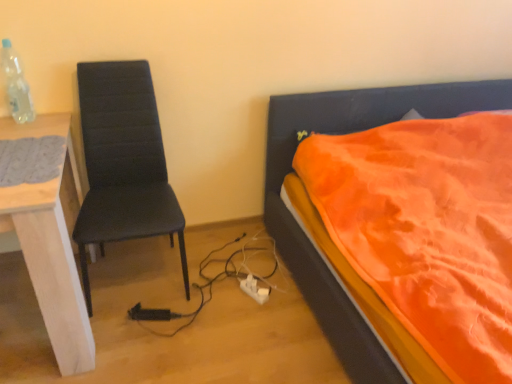
This screenshot has width=512, height=384. Describe the element at coordinates (303, 232) in the screenshot. I see `orange fabric bed at right` at that location.

What is the approximate height of white plastic power plugs and sockets at lower center?

white plastic power plugs and sockets at lower center is 1.58 inches in height.

The height and width of the screenshot is (384, 512). Find the location of `white plastic power plugs and sockets at lower center`. white plastic power plugs and sockets at lower center is located at coordinates (254, 289).

Where is `clear plastic bottle at upper left`? The height and width of the screenshot is (384, 512). clear plastic bottle at upper left is located at coordinates (16, 85).

The width and height of the screenshot is (512, 384). What do you see at coordinates (123, 163) in the screenshot? I see `matte black chair at left` at bounding box center [123, 163].

Measure the distance between point (24, 147) and camera.

Point (24, 147) and camera are 1.57 meters apart from each other.

The height and width of the screenshot is (384, 512). I want to click on orange fabric bed at right, so pos(303,232).

Which is closer to the camera, (9, 70) or (250, 278)?

The point (9, 70) is in front.

Which of these two, clear plastic bottle at upper left or white plastic power plugs and sockets at lower center, stands taller?

clear plastic bottle at upper left is taller.

From the image's perspective, is clear plastic bottle at upper left above or below white plastic power plugs and sockets at lower center?

From the image's perspective, clear plastic bottle at upper left appears above white plastic power plugs and sockets at lower center.

Looking at their sizes, would you say clear plastic bottle at upper left is wider or thinner than white plastic power plugs and sockets at lower center?

In the image, clear plastic bottle at upper left appears to be wider than white plastic power plugs and sockets at lower center.

From the image's perspective, which is below, orange fabric bed at right or matte black chair at left?

orange fabric bed at right is shown below in the image.

Is matte black chair at left located within orange fabric bed at right?

Definitely not — matte black chair at left is not inside orange fabric bed at right.

The image size is (512, 384). I want to click on chair on the left of orange fabric bed at right, so click(x=123, y=163).

Does orange fabric bed at right have a greater width compared to matte black chair at left?

Yes.

From a real-world perspective, is gray knitted mat at left positioned above or below clear plastic bottle at upper left?

From a real-world perspective, gray knitted mat at left is physically below clear plastic bottle at upper left.

Consider the image. Considering the relative sizes of gray knitted mat at left and clear plastic bottle at upper left in the image provided, is gray knitted mat at left thinner than clear plastic bottle at upper left?

No, gray knitted mat at left is not thinner than clear plastic bottle at upper left.

Is gray knitted mat at left positioned in front of clear plastic bottle at upper left?

Yes, gray knitted mat at left is in front of clear plastic bottle at upper left.

How much distance is there between white wood desk at left and matte black chair at left?

white wood desk at left and matte black chair at left are 17.42 inches apart from each other.

From the image's perspective, which object appears higher, white wood desk at left or matte black chair at left?

matte black chair at left is shown above in the image.

From the picture: Between white wood desk at left and matte black chair at left, which one has smaller width?

Thinner between the two is matte black chair at left.

Is white wood desk at left looking in the opposite direction of matte black chair at left?

No, matte black chair at left is not at the back of white wood desk at left.

Considering the relative positions of gray knitted mat at left and matte black chair at left in the image provided, is gray knitted mat at left to the left or to the right of matte black chair at left?

In the image, gray knitted mat at left appears on the left side of matte black chair at left.

Is gray knitted mat at left facing towards matte black chair at left?

No, gray knitted mat at left is not turned towards matte black chair at left.

Based on the photo, which is closer, (14, 183) or (156, 231)?

Point (14, 183) appears to be closer to the viewer than point (156, 231).

Which of these two, gray knitted mat at left or matte black chair at left, stands taller?

matte black chair at left is taller.

Can you confirm if white wood desk at left is positioned to the right of white plastic power plugs and sockets at lower center?

Incorrect, white wood desk at left is not on the right side of white plastic power plugs and sockets at lower center.

From the image's perspective, which is below, white wood desk at left or white plastic power plugs and sockets at lower center?

white plastic power plugs and sockets at lower center, from the image's perspective.

Is white wood desk at left not near white plastic power plugs and sockets at lower center?

No, white wood desk at left is not far from white plastic power plugs and sockets at lower center.

Consider the image. Considering the sizes of objects white wood desk at left and white plastic power plugs and sockets at lower center in the image provided, who is shorter, white wood desk at left or white plastic power plugs and sockets at lower center?

white plastic power plugs and sockets at lower center is shorter.

Can you confirm if matte black chair at left is taller than clear plastic bottle at upper left?

Indeed, matte black chair at left has a greater height compared to clear plastic bottle at upper left.

Can you see matte black chair at left touching clear plastic bottle at upper left?

No, matte black chair at left is not in contact with clear plastic bottle at upper left.

Consider the image. From a real-world perspective, which object rests below the other?

matte black chair at left, from a real-world perspective.

Is the depth of matte black chair at left greater than that of clear plastic bottle at upper left?

No, it is in front of clear plastic bottle at upper left.

The width and height of the screenshot is (512, 384). What are the coordinates of `power plugs and sockets lying behind the clear plastic bottle at upper left` in the screenshot? It's located at (254, 289).

In the image, there is a matte black chair at left. Where is `bed below it (from a real-world perspective)`? bed below it (from a real-world perspective) is located at coordinates (303, 232).

From the image, which object appears to be nearer to gray knitted mat at left, orange fabric bed at right or white plastic power plugs and sockets at lower center?

The object closer to gray knitted mat at left is white plastic power plugs and sockets at lower center.

Which object lies further to the anchor point white wood desk at left, orange fabric bed at right or matte black chair at left?

orange fabric bed at right is positioned further to the anchor white wood desk at left.

Looking at the image, which one is located closer to clear plastic bottle at upper left, white wood desk at left or gray knitted mat at left?

Based on the image, gray knitted mat at left appears to be nearer to clear plastic bottle at upper left.

When comparing their distances from white plastic power plugs and sockets at lower center, does gray knitted mat at left or matte black chair at left seem closer?

Among the two, matte black chair at left is located nearer to white plastic power plugs and sockets at lower center.

Based on their spatial positions, is white plastic power plugs and sockets at lower center or clear plastic bottle at upper left closer to white wood desk at left?

Based on the image, clear plastic bottle at upper left appears to be nearer to white wood desk at left.

From the image, which object appears to be nearer to white wood desk at left, matte black chair at left or white plastic power plugs and sockets at lower center?

The object closer to white wood desk at left is matte black chair at left.

Looking at the image, which one is located further to clear plastic bottle at upper left, white wood desk at left or orange fabric bed at right?

orange fabric bed at right lies further to clear plastic bottle at upper left than the other object.

Looking at the image, which one is located further to orange fabric bed at right, white plastic power plugs and sockets at lower center or gray knitted mat at left?

Among the two, gray knitted mat at left is located further to orange fabric bed at right.

Where is `chair located between gray knitted mat at left and white plastic power plugs and sockets at lower center in the left-right direction`? The width and height of the screenshot is (512, 384). chair located between gray knitted mat at left and white plastic power plugs and sockets at lower center in the left-right direction is located at coordinates (123, 163).

Identify the location of chair located between gray knitted mat at left and orange fabric bed at right in the left-right direction. The width and height of the screenshot is (512, 384). (123, 163).

The width and height of the screenshot is (512, 384). What are the coordinates of `sheet between clear plastic bottle at upper left and white wood desk at left from top to bottom` in the screenshot? It's located at [x=31, y=160].

Image resolution: width=512 pixels, height=384 pixels. What are the coordinates of `sheet between white wood desk at left and orange fabric bed at right from left to right` in the screenshot? It's located at (31, 160).